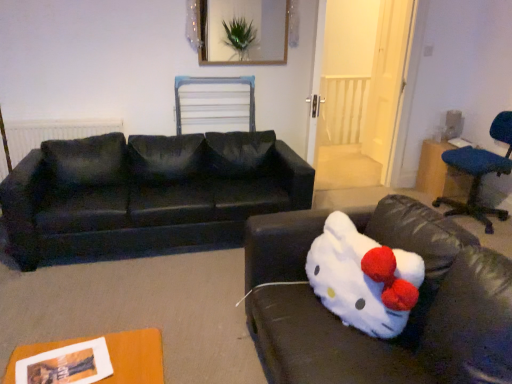
Question: Does point (167, 226) appear closer or farther from the camera than point (256, 31)?

Choices:
 (A) farther
 (B) closer

Answer: (B)

Question: Would you say black fabric couch at left, the first studio couch positioned from the back, is inside or outside wooden picture frame at upper center?

Choices:
 (A) inside
 (B) outside

Answer: (B)

Question: Which is farther from the blue fabric table at right?

Choices:
 (A) wooden picture frame at upper center
 (B) blue fabric chair at right
 (C) white plush toy at lower right, the second studio couch in the back-to-front sequence
 (D) matte black radiator at left
 (E) black fabric couch at left, the second studio couch viewed from the front

Answer: (D)

Question: Considering the real-world distances, which object is closest to the blue fabric table at right?

Choices:
 (A) black fabric couch at left, the second studio couch viewed from the front
 (B) matte black radiator at left
 (C) white plush toy at lower right
 (D) wooden picture frame at upper center
 (E) white plush toy at lower right, the second studio couch in the back-to-front sequence

Answer: (D)